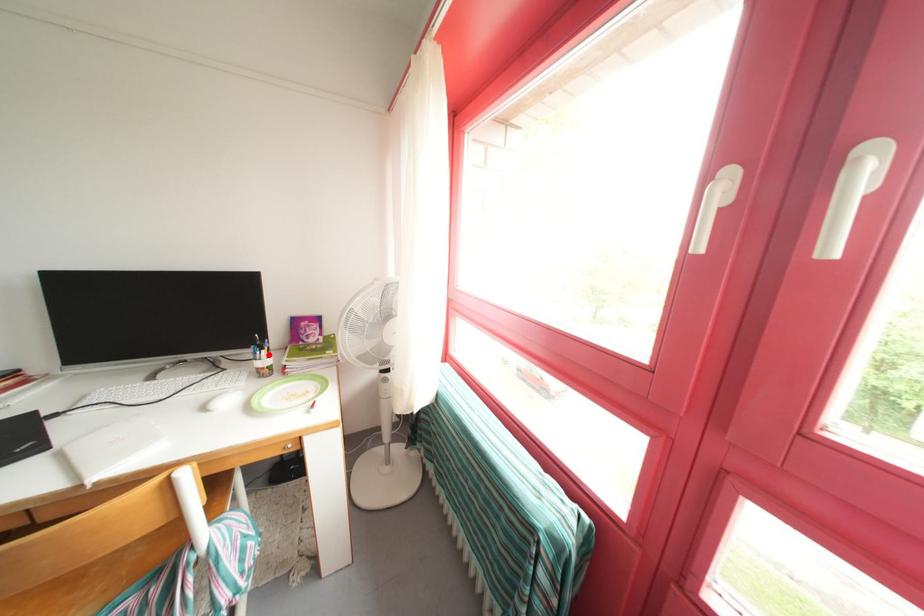
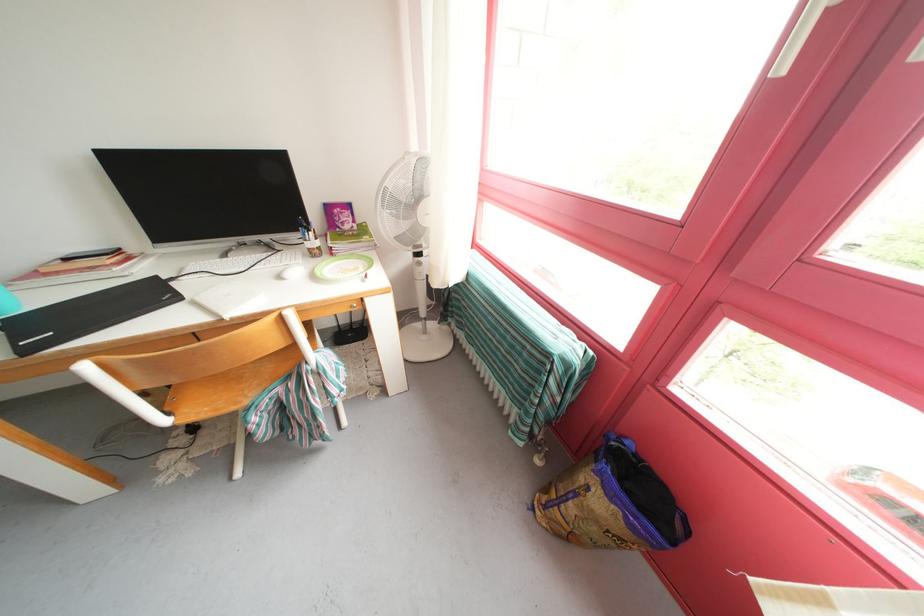
Find the pixel in the second image that matches the highlighted location in the first image.

(315, 236)